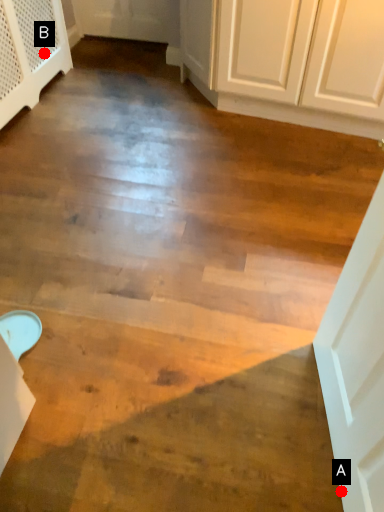
Question: Two points are circled on the image, labeled by A and B beside each circle. Which of the following is the closest to the observer?

Choices:
 (A) A is closer
 (B) B is closer

Answer: (A)